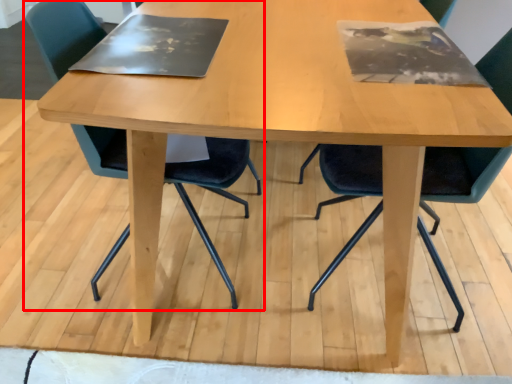
Question: In this image, where is chair (annotated by the red box) located relative to chair?

Choices:
 (A) left
 (B) right

Answer: (A)